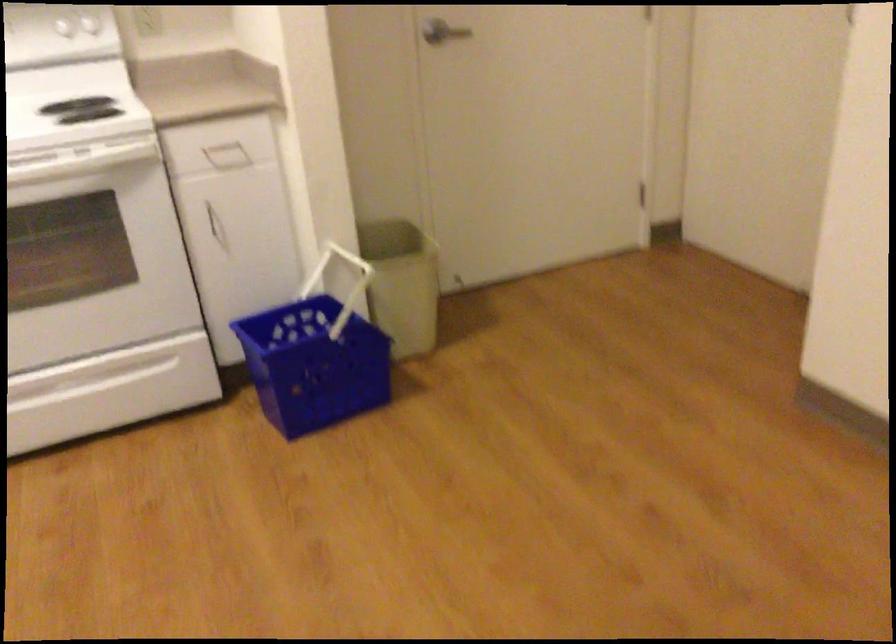
The image size is (896, 644). Describe the element at coordinates (437, 35) in the screenshot. I see `the silver door handle` at that location.